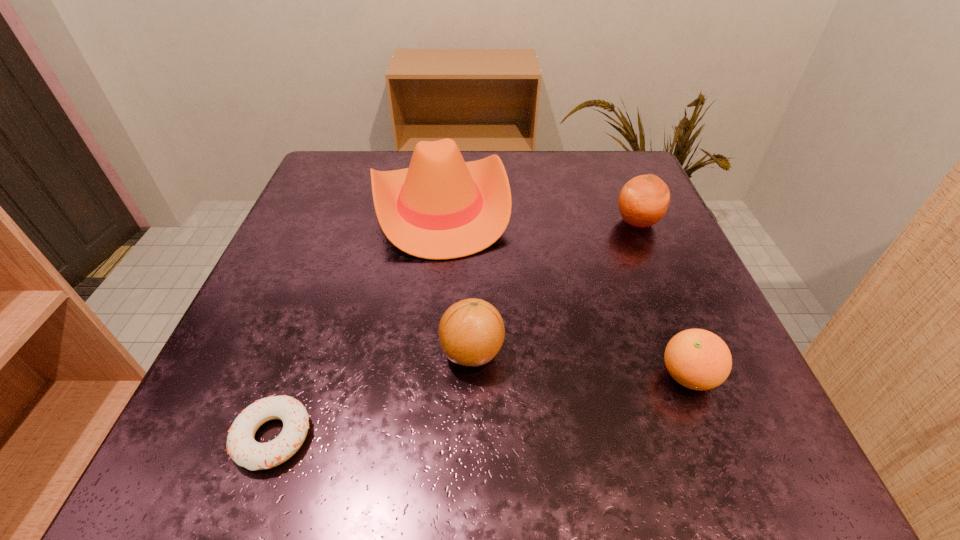
What are the coordinates of `free space located on the left of the doughnut` in the screenshot? It's located at (187, 437).

You are a GUI agent. You are given a task and a screenshot of the screen. Output one action in this format:
    pyautogui.click(x=<x>, y=<y>)
    Task: Click on the cowboy hat at the far edge
    
    Given the screenshot: What is the action you would take?
    pyautogui.click(x=441, y=207)

At what (x,y) coordinates should I click in order to perform the action: click on orange located at the far edge. Please return your answer as a coordinate pair (x, y). The width and height of the screenshot is (960, 540). Looking at the image, I should click on (643, 201).

This screenshot has height=540, width=960. I want to click on object positioned at the near edge, so click(x=241, y=446).

At what (x,y) coordinates should I click in order to perform the action: click on cowboy hat located in the left edge section of the desktop. Please return your answer as a coordinate pair (x, y). The width and height of the screenshot is (960, 540). Looking at the image, I should click on pos(441,207).

Image resolution: width=960 pixels, height=540 pixels. Find the location of `doughnut positioned at the left edge`. doughnut positioned at the left edge is located at coordinates (241, 446).

Find the location of a particular element. The width and height of the screenshot is (960, 540). object at the far left corner is located at coordinates (441, 207).

In order to click on object situated at the near left corner in this screenshot , I will do `click(241, 446)`.

Find the location of `object present at the far right corner`. object present at the far right corner is located at coordinates (643, 201).

Locate an element on the screen. This screenshot has height=540, width=960. free spot at the far edge of the desktop is located at coordinates (532, 204).